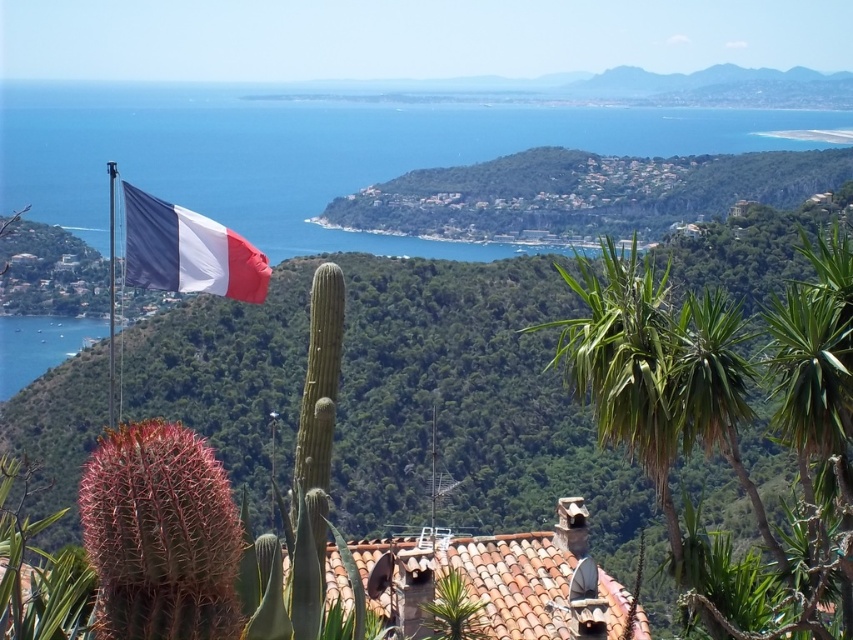
You are a hiker who wants to reach the green leafy palm tree at center from your current position near the green leafy cactus at upper left. The map shows that the straight line distance between them is 331.14 feet. However, the terrain between them is rough and uneven. Do you think you can walk directly towards the palm tree without any obstacles?

The straight line distance between the green leafy cactus at upper left and the green leafy palm tree at center is 331.14 feet. However, the terrain between them is rough and uneven, so you cannot walk directly towards the palm tree without encountering obstacles.